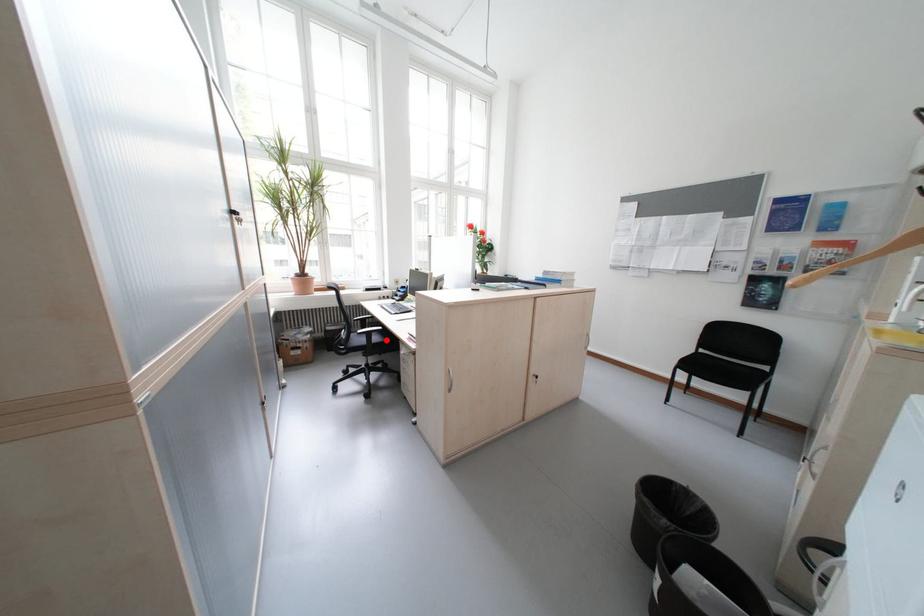
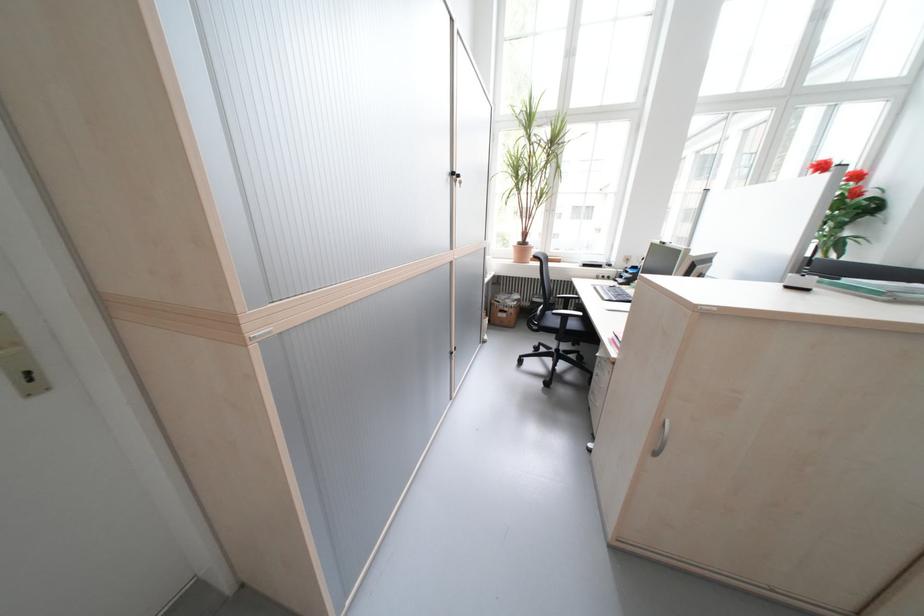
Question: I am providing you with two images of the same scene from different viewpoints. In image1, a red point is highlighted. Considering the same 3D point in image2, which of the following is correct?

Choices:
 (A) It is closer
 (B) It is farther

Answer: (A)